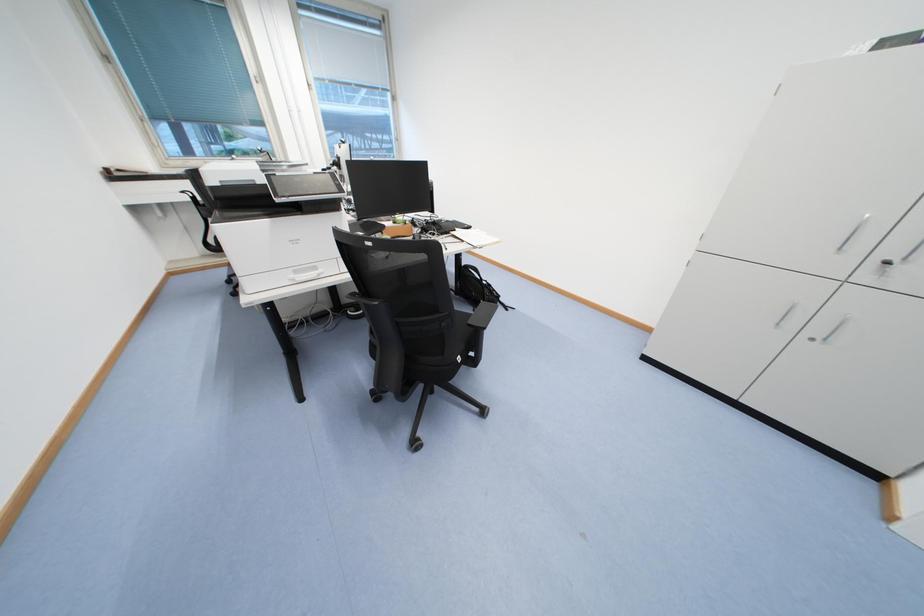
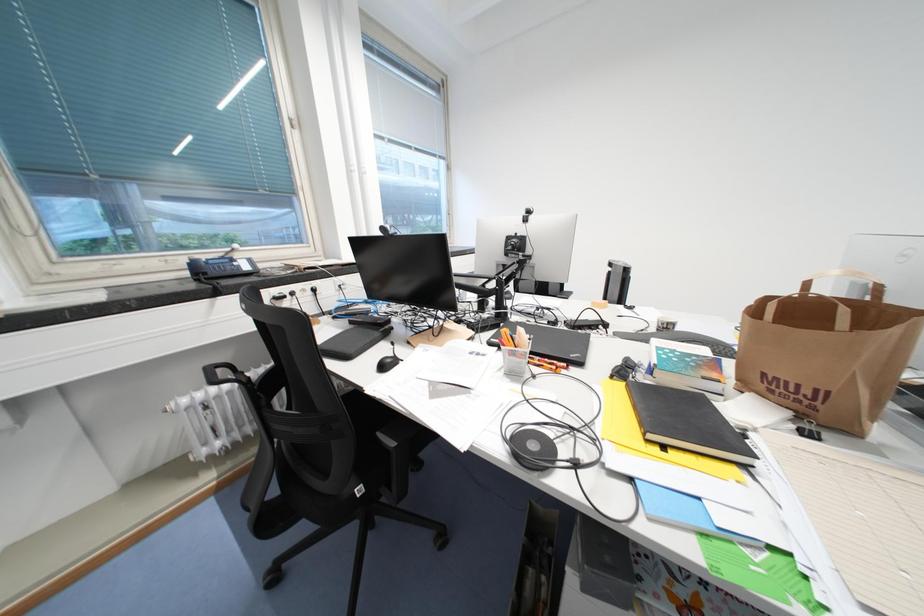
Which direction would the cameraman need to move to produce the second image?

The movement direction of the cameraman is left, forward.